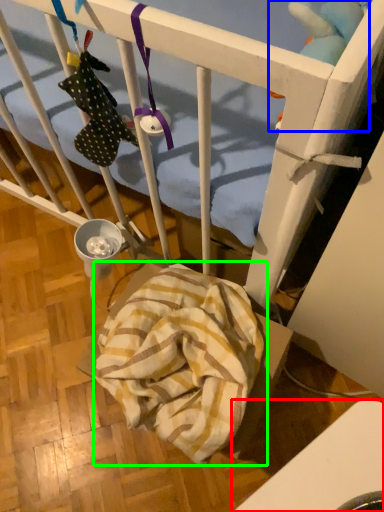
Question: Considering the real-world distances, which object is farthest from furniture (highlighted by a red box)? toy (highlighted by a blue box) or blanket (highlighted by a green box)?

Choices:
 (A) toy
 (B) blanket

Answer: (A)